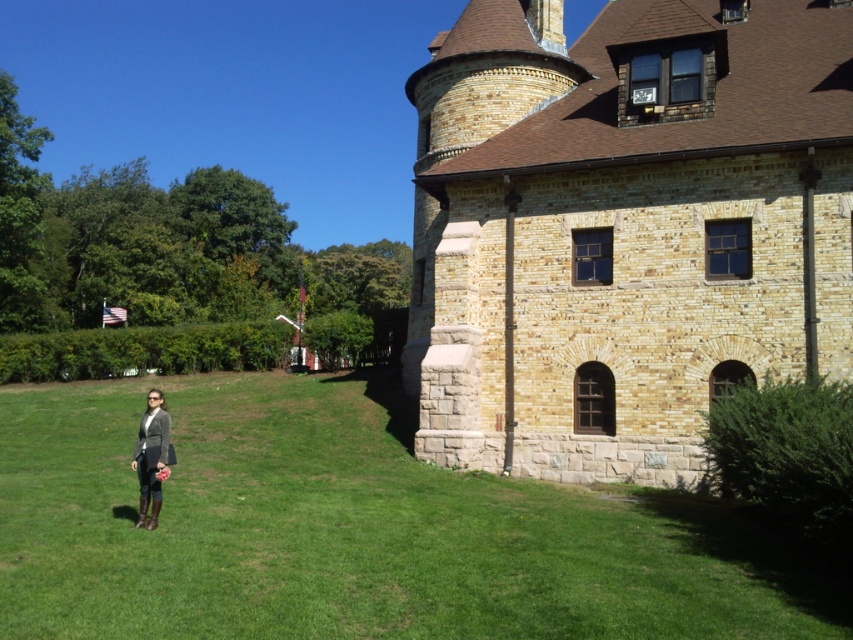
Question: Which of these objects is positioned farthest from the matte gray blazer at lower left?

Choices:
 (A) green grass at lower left
 (B) brown stone castle at center

Answer: (B)

Question: Is green grass at lower left to the right of matte gray blazer at lower left from the viewer's perspective?

Choices:
 (A) yes
 (B) no

Answer: (A)

Question: Can you confirm if brown stone castle at center is thinner than green grass at lower left?

Choices:
 (A) yes
 (B) no

Answer: (A)

Question: Which of the following is the closest to the observer?

Choices:
 (A) brown stone castle at center
 (B) green grass at lower left
 (C) matte gray blazer at lower left

Answer: (B)

Question: Which is nearer to the brown stone castle at center?

Choices:
 (A) green grass at lower left
 (B) matte gray blazer at lower left

Answer: (A)

Question: Does green grass at lower left have a lesser width compared to matte gray blazer at lower left?

Choices:
 (A) no
 (B) yes

Answer: (A)